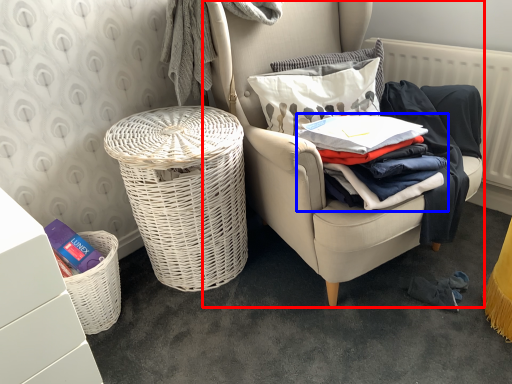
Question: Which point is further to the camera, chair (highlighted by a red box) or clothing (highlighted by a blue box)?

Choices:
 (A) chair
 (B) clothing

Answer: (B)